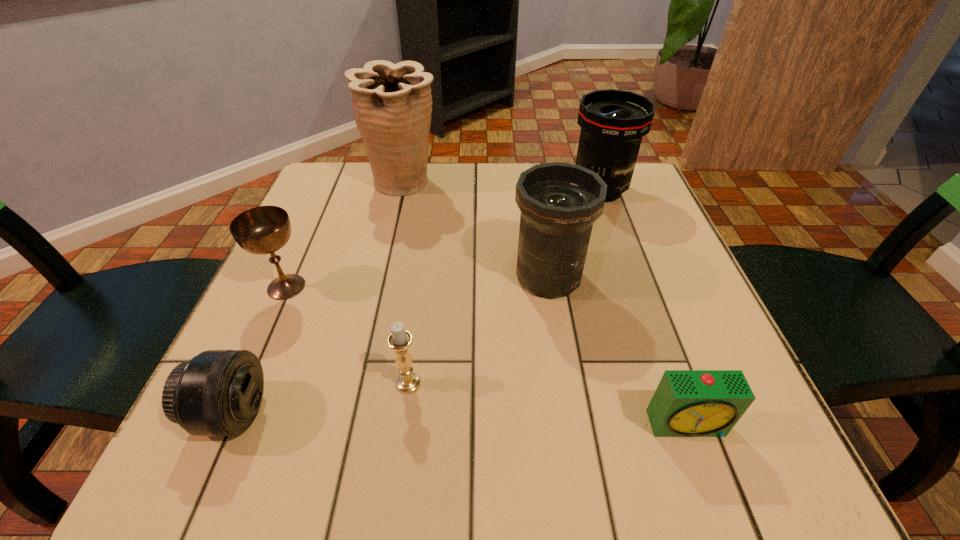
You are a GUI agent. You are given a task and a screenshot of the screen. Output one action in this format:
    pyautogui.click(x=<x>, y=<y>)
    Task: Click on the vacant area that satisfies the following two spatial constraints: 1. on the back side of the chalice; 2. on the left side of the rightmost telephoto lens
    The height and width of the screenshot is (540, 960).
    Given the screenshot: What is the action you would take?
    pyautogui.click(x=329, y=190)